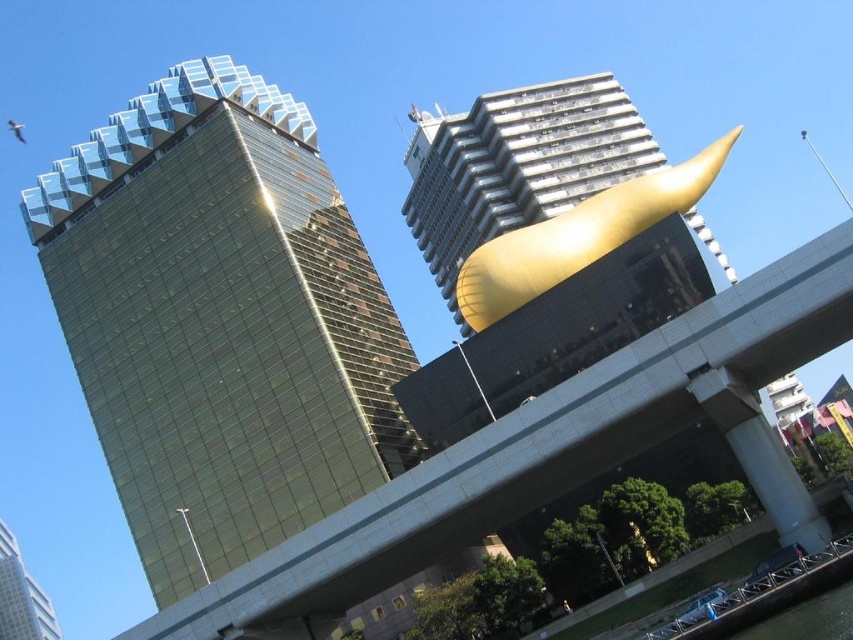
Question: Is gold metallic sculpture at upper right in front of black rubber waterway at lower right?

Choices:
 (A) no
 (B) yes

Answer: (A)

Question: Does shiny glass skyscraper at left have a lesser width compared to gold metallic sculpture at upper right?

Choices:
 (A) no
 (B) yes

Answer: (B)

Question: Which point appears farthest from the camera in this image?

Choices:
 (A) (619, 113)
 (B) (825, 605)
 (C) (171, 120)

Answer: (A)

Question: Is shiny glass skyscraper at left to the right of black rubber waterway at lower right from the viewer's perspective?

Choices:
 (A) no
 (B) yes

Answer: (A)

Question: Based on their relative distances, which object is nearer to the black rubber waterway at lower right?

Choices:
 (A) shiny glass skyscraper at left
 (B) matte glass skyscraper at center

Answer: (A)

Question: Which point is farther from the camera taking this photo?

Choices:
 (A) (633, 132)
 (B) (24, 618)
 (C) (326, 509)

Answer: (B)